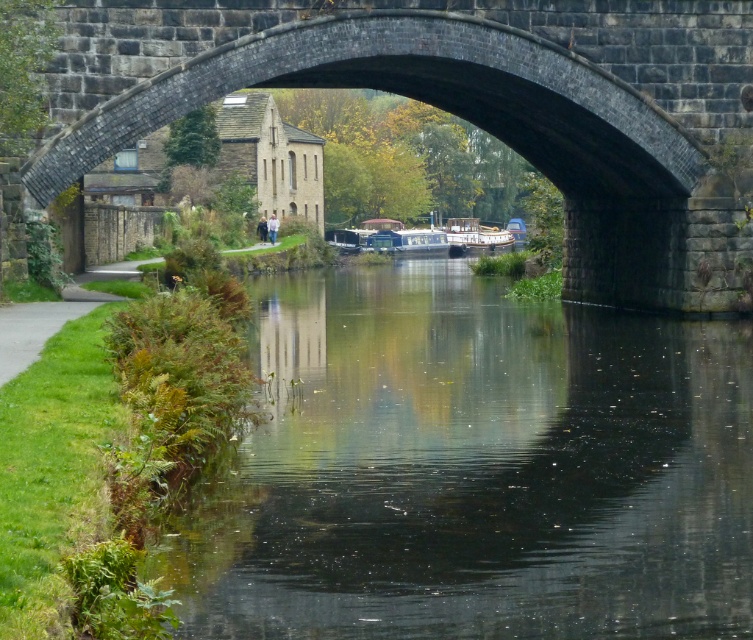
Is transparent water at center closer to camera compared to wooden polished boat at center?

Yes, it is in front of wooden polished boat at center.

Does transparent water at center lie behind wooden polished boat at center?

That is False.

The image size is (753, 640). Find the location of `transparent water at center`. transparent water at center is located at coordinates (474, 468).

This screenshot has width=753, height=640. I want to click on transparent water at center, so 474,468.

Is dark gray stone bridge at center further to the viewer compared to wooden polished boat at center?

No, dark gray stone bridge at center is closer to the viewer.

Which is more to the right, dark gray stone bridge at center or wooden polished boat at center?

wooden polished boat at center is more to the right.

Does point (114, 148) come behind point (471, 227)?

No.

Locate an element on the screen. dark gray stone bridge at center is located at coordinates (468, 106).

Which is below, transparent water at center or dark gray stone bridge at center?

transparent water at center is lower down.

Does transparent water at center have a greater width compared to dark gray stone bridge at center?

No.

This screenshot has height=640, width=753. I want to click on transparent water at center, so click(x=474, y=468).